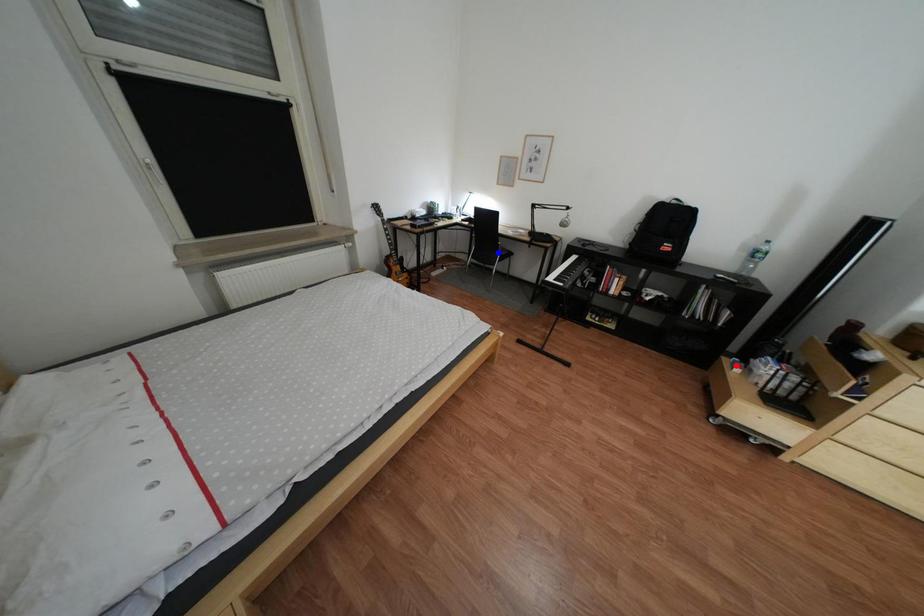
Question: Which of the two points in the image is closer to the camera?

Choices:
 (A) Blue point is closer.
 (B) Red point is closer.

Answer: (B)